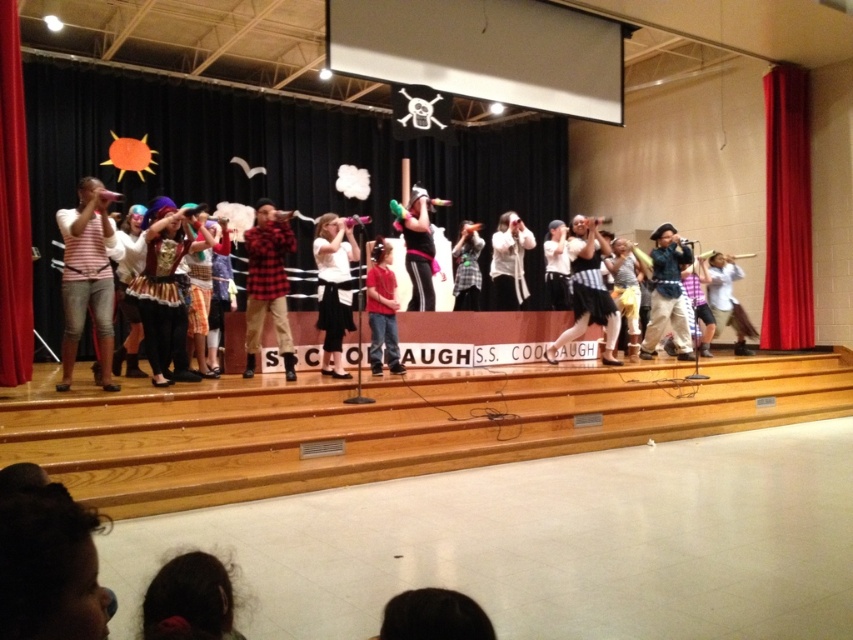
Is dark brown hair at lower left smaller than blue jeans at center?

Yes.

Which is behind, point (206, 618) or point (393, 301)?

Point (393, 301)

Between point (195, 608) and point (376, 339), which one is positioned in front?

Point (195, 608)

You are a GUI agent. You are given a task and a screenshot of the screen. Output one action in this format:
    pyautogui.click(x=<x>, y=<y>)
    Task: Click on the dark brown hair at lower left
    
    Given the screenshot: What is the action you would take?
    pyautogui.click(x=189, y=600)

Does blue jeans at center have a larger size compared to white striped shirt at center?

No.

Who is more forward, (379, 324) or (711, 317)?

Point (379, 324) is in front.

Is point (387, 342) positioned before point (705, 308)?

Yes, it is.

What are the coordinates of `blue jeans at center` in the screenshot? It's located at (381, 307).

You are a GUI agent. You are given a task and a screenshot of the screen. Output one action in this format:
    pyautogui.click(x=<x>, y=<y>)
    Task: Click on the dark brown hair at lower center
    The height and width of the screenshot is (640, 853).
    Given the screenshot: What is the action you would take?
    pyautogui.click(x=434, y=616)

Which is behind, point (463, 632) or point (416, 256)?

The point (416, 256) is behind.

I want to click on dark brown hair at lower center, so click(434, 616).

Identify the location of dark brown hair at lower center. This screenshot has height=640, width=853. tap(434, 616).